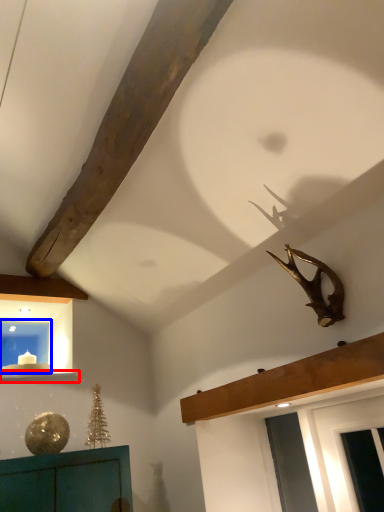
Question: Which point is closer to the camera, window sill (highlighted by a red box) or window (highlighted by a blue box)?

Choices:
 (A) window sill
 (B) window

Answer: (A)